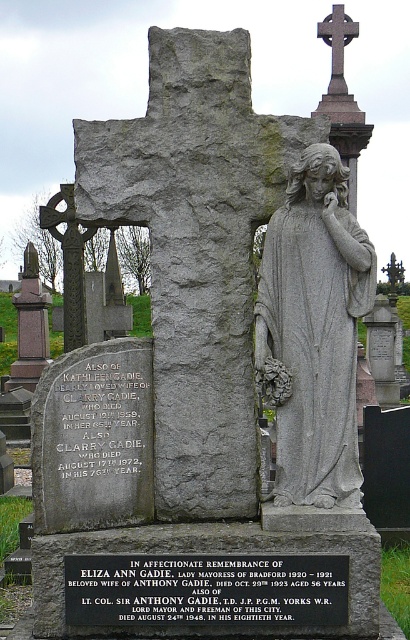
What is located at the coordinates point (205, 589) on the gravestone monument?

The point (205, 589) corresponds to the black metal plaque at center.

You are an archaeologist examining the gravestone monument. You notice the black metal plaque at center and the smooth stone cross at upper center. Which object is taller?

The smooth stone cross at upper center is taller than the black metal plaque at center.